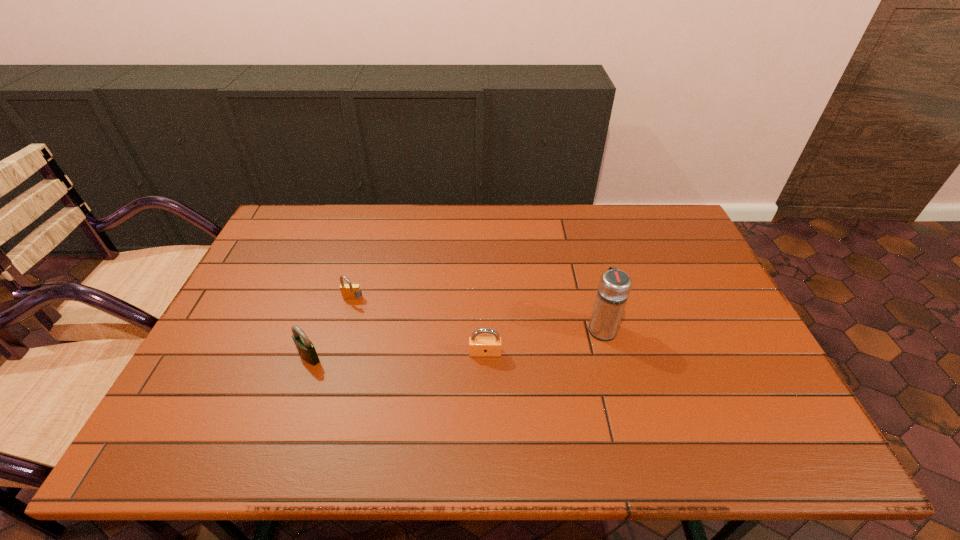
Choose which object is the nearest neighbor to the leftmost padlock. Please provide its 2D coordinates. Your answer should be formatted as a tuple, i.e. [(x, y)], where the tuple contains the x and y coordinates of a point satisfying the conditions above.

[(349, 291)]

Find the location of a particular element. The height and width of the screenshot is (540, 960). the second closest padlock relative to the third object from left to right is located at coordinates click(x=306, y=349).

Identify the location of the second closest padlock relative to the leftmost padlock. (x=478, y=346).